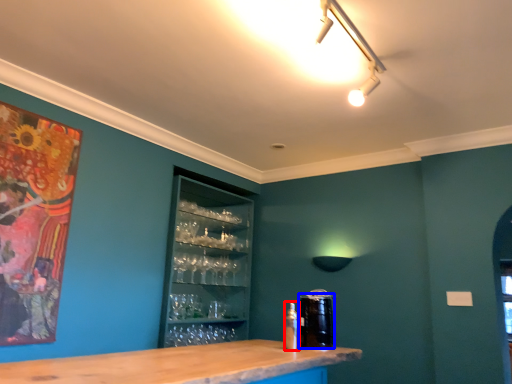
Question: Which point is further to the camera, bottle (highlighted by a red box) or beverage (highlighted by a blue box)?

Choices:
 (A) bottle
 (B) beverage

Answer: (B)